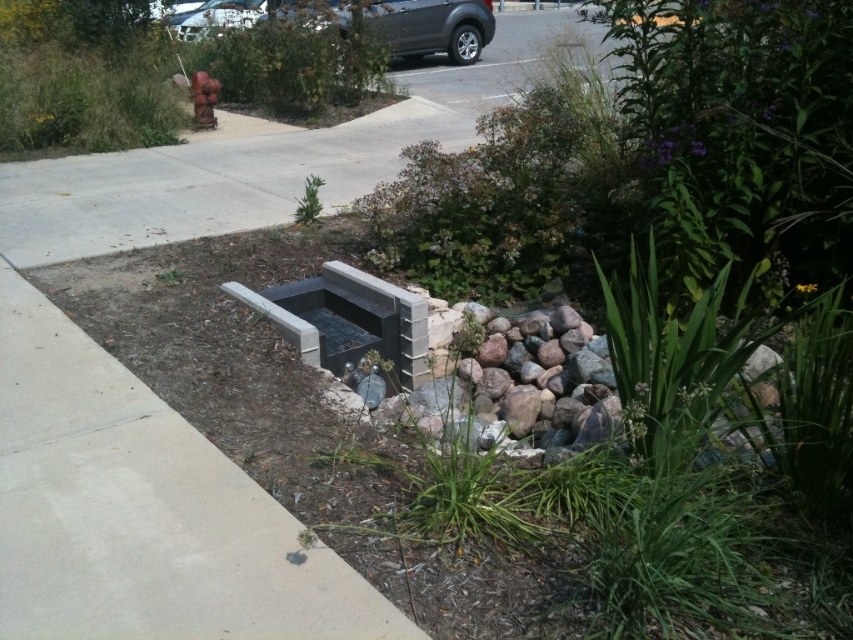
From the picture: You are a landscape architect designing a pathway that needs to go around both the concrete at center and the rusty metal hydrant at upper center. Which object should you consider first when planning the path to ensure adequate clearance?

The concrete at center should be considered first because it is much taller than the rusty metal hydrant at upper center, requiring more space for clearance.

You are a parking attendant and need to fit both cars into a parking space that is 2.5 meters wide. Given that the dark gray metallic car at upper center and the metallic silver car at upper center are parked side by side, will they both fit within the space?

The dark gray metallic car at upper center is wider than the metallic silver car at upper center. However, without knowing the exact widths of both cars, it is impossible to determine if they will fit within the 2.5 meter parking space.